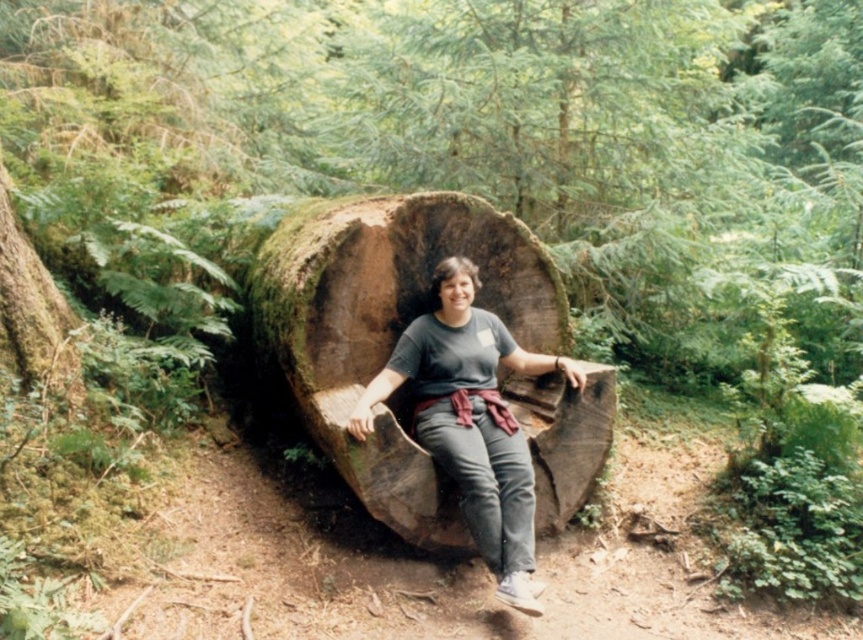
Question: Is matte gray shirt at center thinner than green mossy log at left?

Choices:
 (A) yes
 (B) no

Answer: (B)

Question: Does matte gray shirt at center lie behind green mossy log at left?

Choices:
 (A) no
 (B) yes

Answer: (A)

Question: Among these points, which one is farthest from the camera?

Choices:
 (A) (498, 445)
 (B) (72, 323)

Answer: (B)

Question: Does matte gray shirt at center have a greater width compared to green mossy log at left?

Choices:
 (A) yes
 (B) no

Answer: (A)

Question: Among these objects, which one is nearest to the camera?

Choices:
 (A) green mossy log at left
 (B) matte gray shirt at center

Answer: (B)

Question: Which of the following is the closest to the observer?

Choices:
 (A) matte gray shirt at center
 (B) green mossy log at left

Answer: (A)